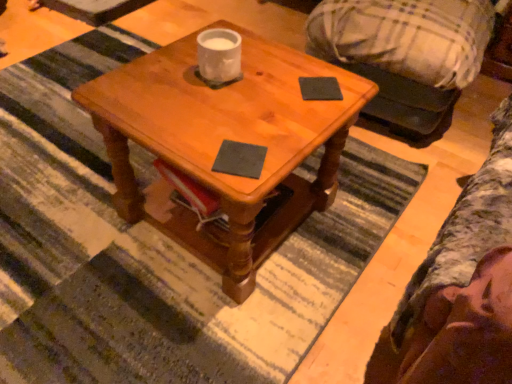
The image size is (512, 384). Find the location of `vacant region above wooden coffee table at center (from a real-world perspective)`. vacant region above wooden coffee table at center (from a real-world perspective) is located at coordinates (205, 96).